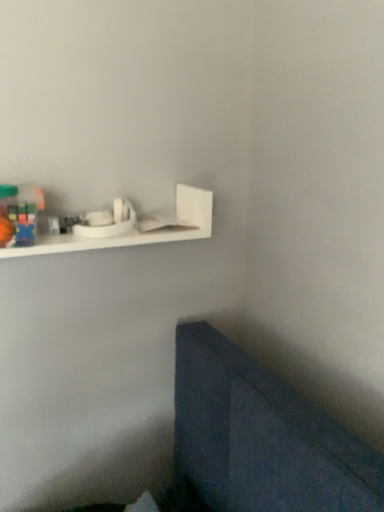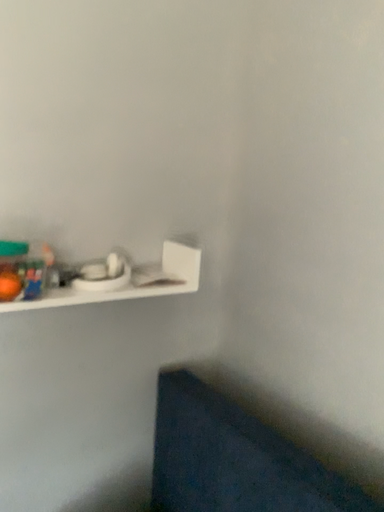
Question: Which way did the camera rotate in the video?

Choices:
 (A) rotated left
 (B) rotated right

Answer: (B)